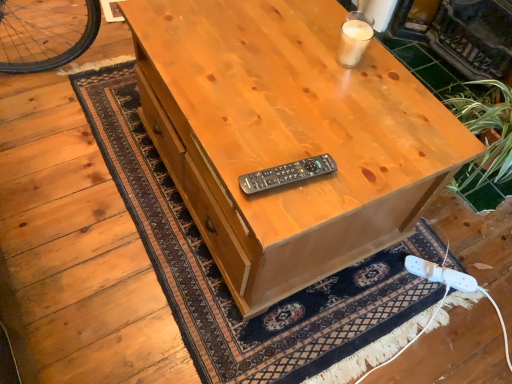
Question: Can you confirm if white plastic game controller at lower right is positioned to the left of black plastic remote at center?

Choices:
 (A) yes
 (B) no

Answer: (B)

Question: Is white plastic game controller at lower right next to black plastic remote at center?

Choices:
 (A) no
 (B) yes

Answer: (A)

Question: From a real-world perspective, is white plastic game controller at lower right beneath black plastic remote at center?

Choices:
 (A) no
 (B) yes

Answer: (B)

Question: Does white plastic game controller at lower right lie behind black plastic remote at center?

Choices:
 (A) yes
 (B) no

Answer: (A)

Question: Does white plastic game controller at lower right have a lesser width compared to black plastic remote at center?

Choices:
 (A) yes
 (B) no

Answer: (B)

Question: In terms of width, does white plastic game controller at lower right look wider or thinner when compared to black plastic remote at center?

Choices:
 (A) wide
 (B) thin

Answer: (A)

Question: Based on their sizes in the image, would you say white plastic game controller at lower right is bigger or smaller than black plastic remote at center?

Choices:
 (A) big
 (B) small

Answer: (A)

Question: Is white plastic game controller at lower right taller or shorter than black plastic remote at center?

Choices:
 (A) tall
 (B) short

Answer: (B)

Question: In the image, is white plastic game controller at lower right positioned in front of or behind black plastic remote at center?

Choices:
 (A) front
 (B) behind

Answer: (B)

Question: Considering the positions of white plastic game controller at lower right and green tile fireplace at upper right in the image, is white plastic game controller at lower right taller or shorter than green tile fireplace at upper right?

Choices:
 (A) tall
 (B) short

Answer: (B)

Question: Considering the positions of white plastic game controller at lower right and green tile fireplace at upper right in the image, is white plastic game controller at lower right bigger or smaller than green tile fireplace at upper right?

Choices:
 (A) small
 (B) big

Answer: (A)

Question: Is white plastic game controller at lower right situated inside green tile fireplace at upper right or outside?

Choices:
 (A) inside
 (B) outside

Answer: (B)

Question: From the image's perspective, is white plastic game controller at lower right above or below green tile fireplace at upper right?

Choices:
 (A) below
 (B) above

Answer: (A)

Question: Is point (295, 180) positioned closer to the camera than point (458, 284)?

Choices:
 (A) closer
 (B) farther

Answer: (A)

Question: From a real-world perspective, is black plastic remote at center positioned above or below white plastic game controller at lower right?

Choices:
 (A) above
 (B) below

Answer: (A)